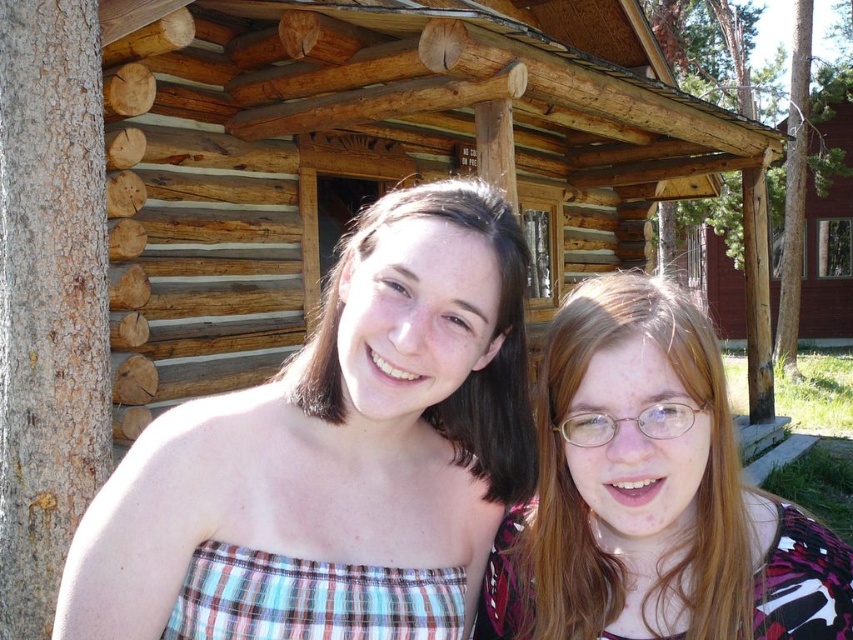
Can you confirm if plaid fabric top at center is positioned above matte brown hair at center?

No, plaid fabric top at center is not above matte brown hair at center.

How much distance is there between plaid fabric top at center and matte brown hair at center?

A distance of 5.74 inches exists between plaid fabric top at center and matte brown hair at center.

Which is behind, point (384, 461) or point (445, 401)?

The point (445, 401) is more distant.

The height and width of the screenshot is (640, 853). I want to click on plaid fabric top at center, so click(335, 451).

How distant is plaid fabric top at center from wooden cabin at upper right?

The distance of plaid fabric top at center from wooden cabin at upper right is 19.38 meters.

Is plaid fabric top at center positioned in front of wooden cabin at upper right?

Yes, it is.

Locate an element on the screen. The height and width of the screenshot is (640, 853). plaid fabric top at center is located at coordinates (335, 451).

Is clear plastic glasses at center shorter than matte brown hair at center?

No, clear plastic glasses at center is not shorter than matte brown hair at center.

Is point (630, 344) positioned after point (440, 195)?

No.

Locate an element on the screen. This screenshot has width=853, height=640. clear plastic glasses at center is located at coordinates (653, 493).